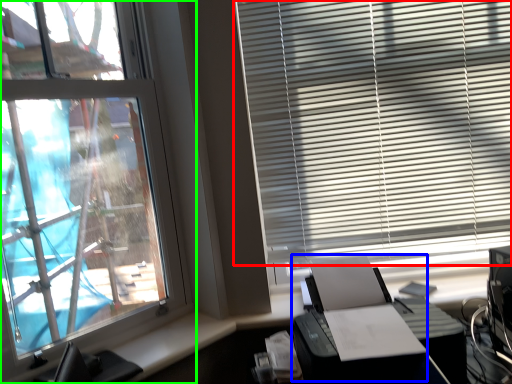
Question: Which object is the closest to the window blind (highlighted by a red box)? Choose among these: printer (highlighted by a blue box) or window (highlighted by a green box).

Choices:
 (A) printer
 (B) window

Answer: (A)